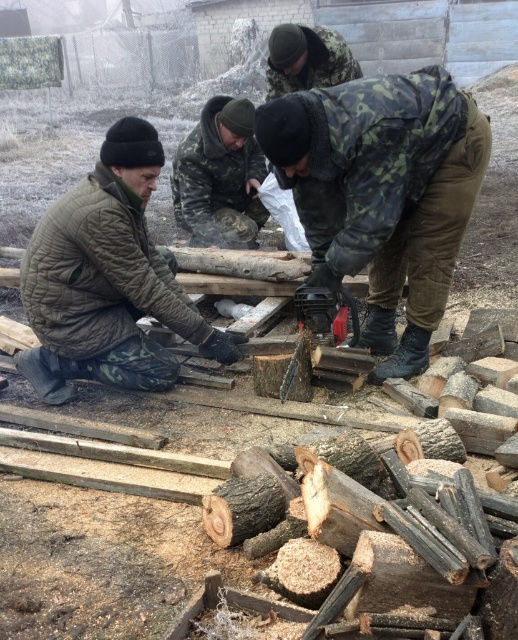
Can you confirm if camo fabric jacket at center is taller than camouflage fabric jacket at upper center?

Yes.

You are a GUI agent. You are given a task and a screenshot of the screen. Output one action in this format:
    pyautogui.click(x=<x>, y=<y>)
    Task: Click on the camo fabric jacket at center
    This screenshot has width=518, height=640.
    Given the screenshot: What is the action you would take?
    pyautogui.click(x=382, y=193)

Does camouflage jacket at center lie in front of camouflage fabric jacket at upper center?

That is False.

Does point (208, 209) come farther from viewer compared to point (309, 58)?

That is True.

The image size is (518, 640). What are the coordinates of `camouflage jacket at center` in the screenshot? It's located at (220, 177).

The height and width of the screenshot is (640, 518). What are the coordinates of `camouflage jacket at center` in the screenshot? It's located at (220, 177).

Does point (83, 355) lie behind point (323, 29)?

No, it is in front of (323, 29).

Looking at this image, is camouflage jacket at left thinner than camouflage fabric jacket at upper center?

Incorrect, camouflage jacket at left's width is not less than camouflage fabric jacket at upper center's.

Which is in front, point (97, 289) or point (328, 45)?

Positioned in front is point (97, 289).

The image size is (518, 640). Find the location of `camouflage jacket at left`. camouflage jacket at left is located at coordinates (107, 280).